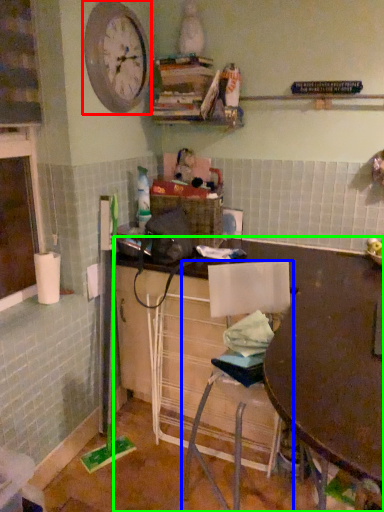
Question: Which object is positioned closest to clock (highlighted by a red box)? Select from chair (highlighted by a blue box) and desk (highlighted by a green box).

Choices:
 (A) chair
 (B) desk

Answer: (A)